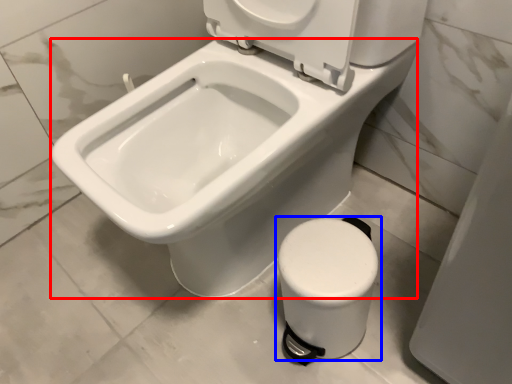
Question: Which object is further to the camera taking this photo, bidet (highlighted by a red box) or toilet (highlighted by a blue box)?

Choices:
 (A) bidet
 (B) toilet

Answer: (B)